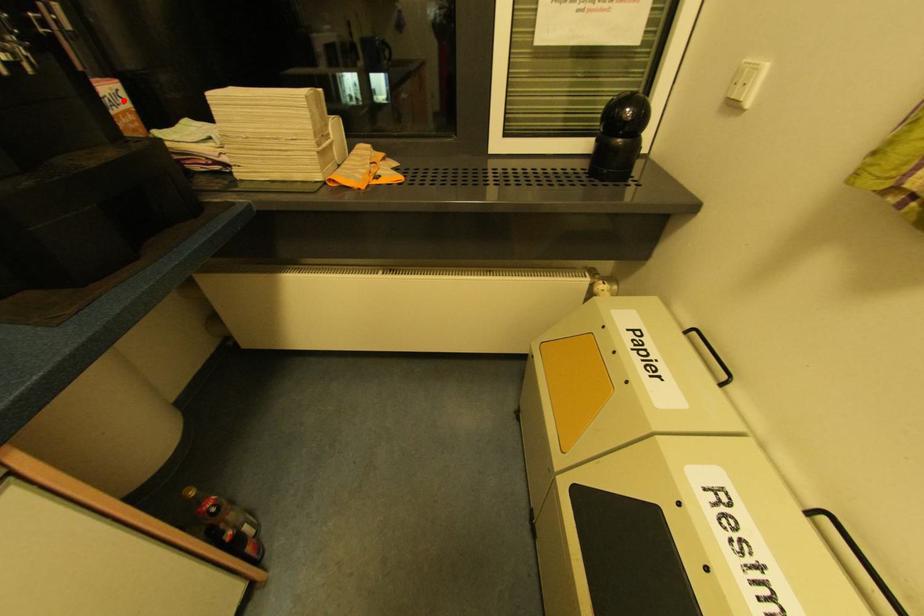
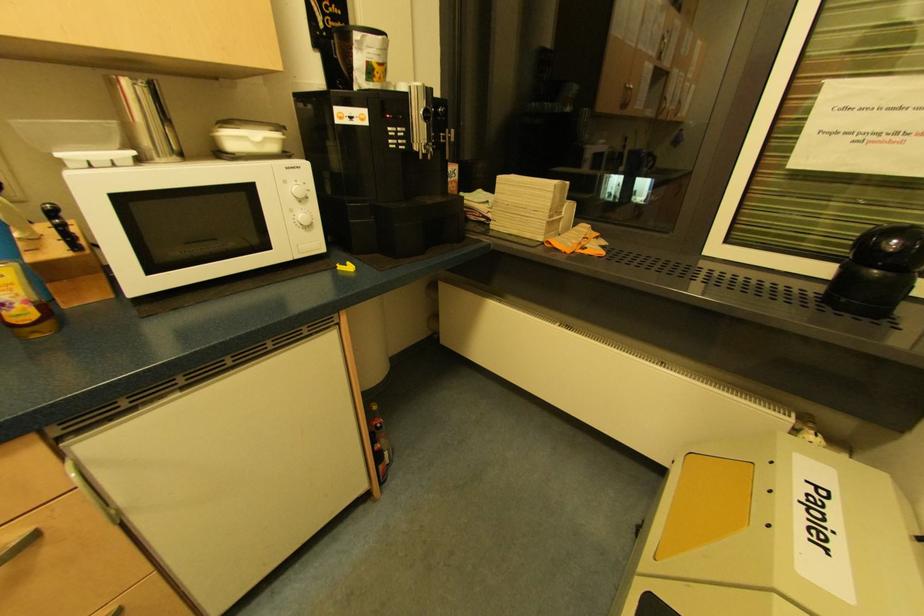
Where in the second image is the point corresponding to the highlighted location from the first image?

(457, 175)